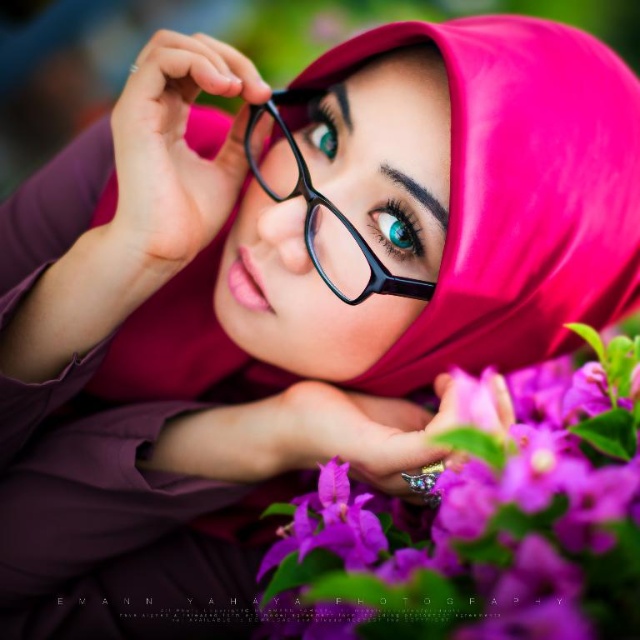
Consider the image. The person is holding the black plastic glasses at center. Where exactly are the glasses positioned relative to the person?

The black plastic glasses at center are positioned at point coordinates of approximately 0.316 on the x axis and 0.495 on the y axis relative to the person.

You are a photographer adjusting the camera settings to focus on the purple matte flower at center and the teal glossy eye at center. Given their sizes, which object should you prioritize focusing on to ensure clarity in the final photo?

The purple matte flower at center has a larger size compared to the teal glossy eye at center, so you should prioritize focusing on the purple matte flower at center to ensure clarity since it occupies more space in the frame.